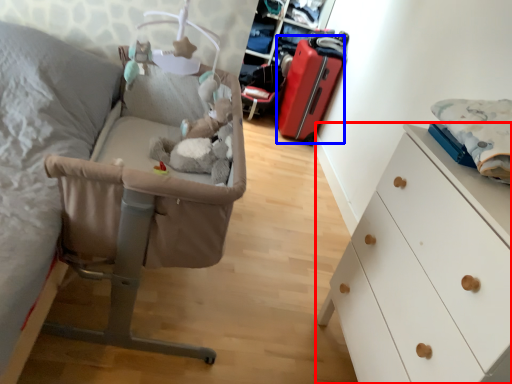
Question: Which object is further to the camera taking this photo, chest of drawers (highlighted by a red box) or luggage (highlighted by a blue box)?

Choices:
 (A) chest of drawers
 (B) luggage

Answer: (B)